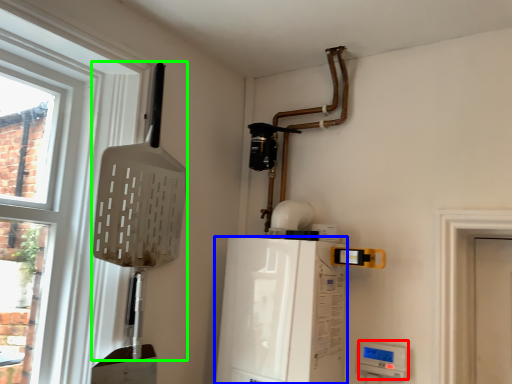
Question: Which is nearer to the appliance (highlighted by a red box)? appliance (highlighted by a blue box) or shovel (highlighted by a green box).

Choices:
 (A) appliance
 (B) shovel

Answer: (A)